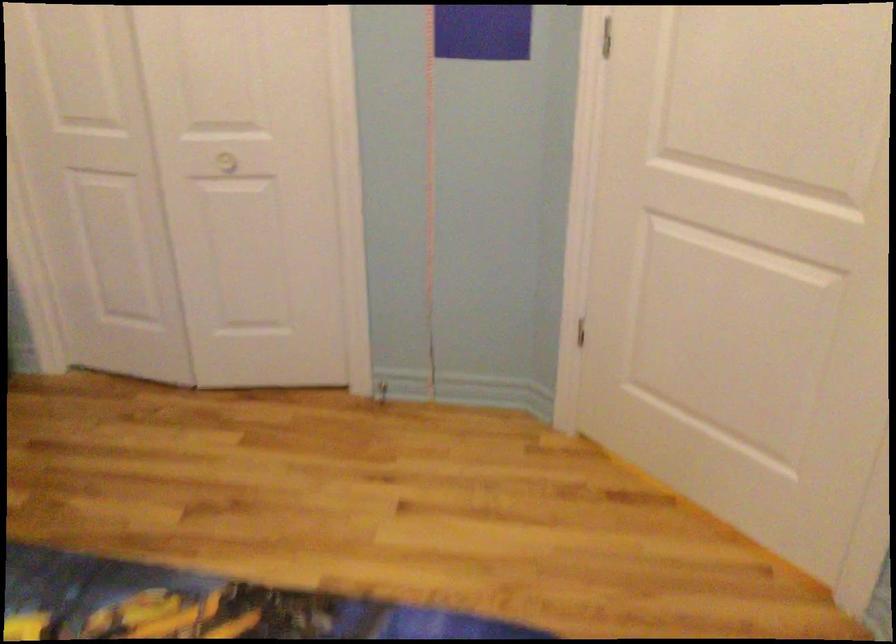
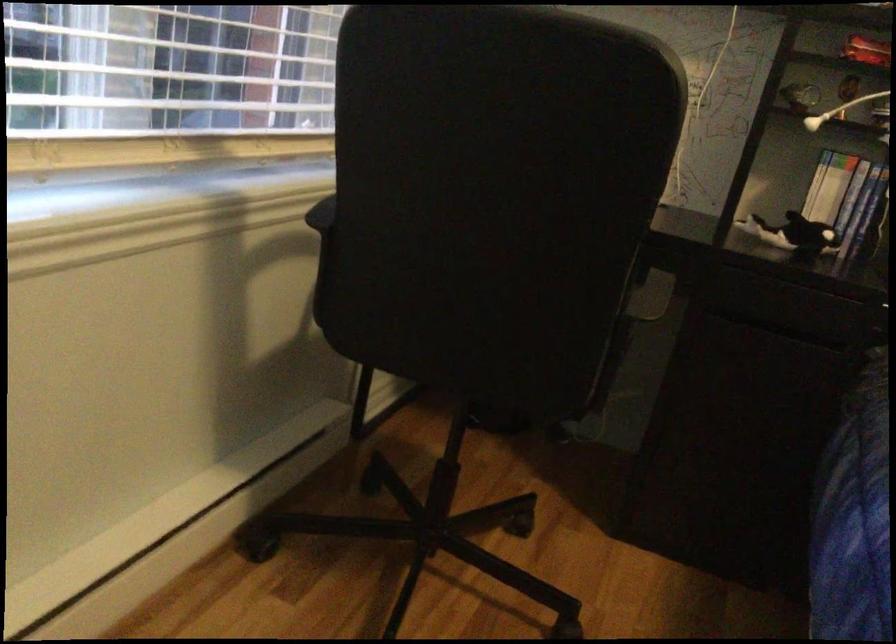
From the picture: The first image is from the beginning of the video and the second image is from the end. How did the camera likely rotate when shooting the video?

The rotation direction of the camera is left-down.